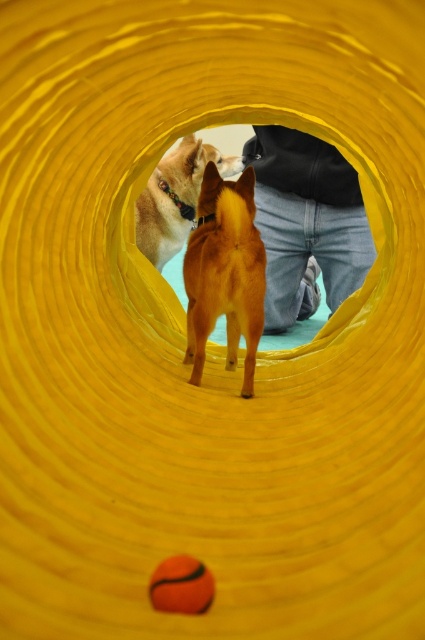
You are standing inside a bright yellow tunnel and notice a shiny spot. According to the coordinates provided, where exactly is the shiny golden fur at center located?

The shiny golden fur at center is located at the coordinates point (224, 273).

You are standing inside the yellow tunnel and want to know which of the two dogs at the center has a smaller size. Please identify the dog with the shiny golden fur at center and the shiny brown fur at center. Which one is smaller?

The shiny golden fur at center is smaller than the shiny brown fur at center.